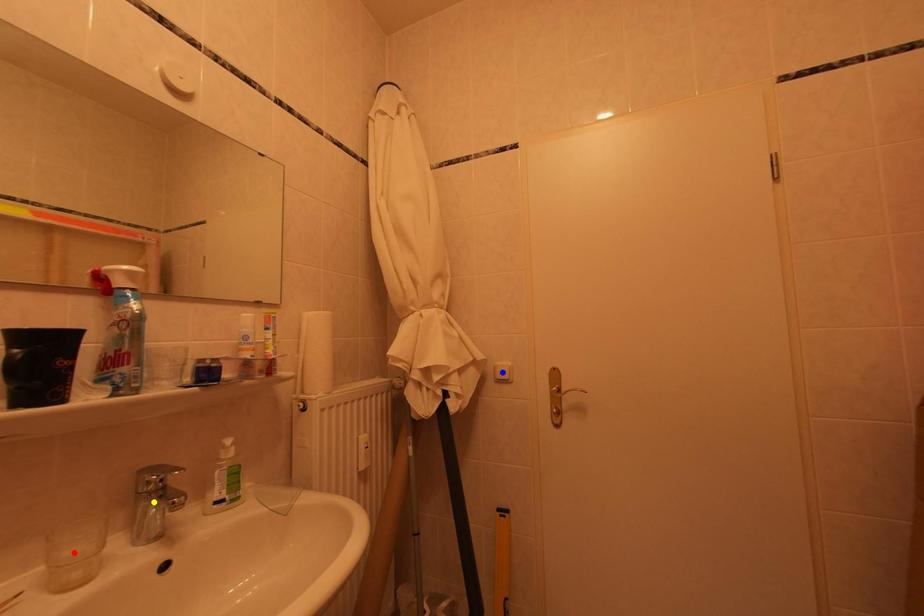
Order these from nearest to farthest:
1. blue point
2. yellow point
3. red point

red point < yellow point < blue point